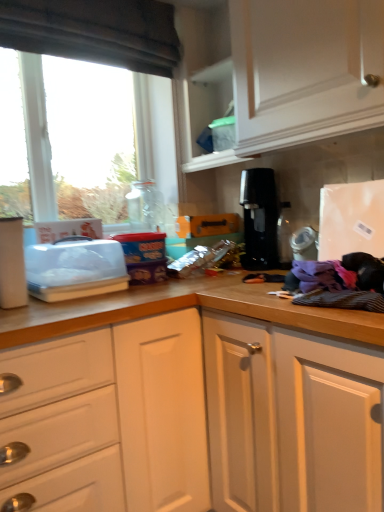
Question: Could you tell me if transparent glass window at left is facing dark fabric exhaust hood at upper left?

Choices:
 (A) no
 (B) yes

Answer: (A)

Question: Does transparent glass window at left have a lesser width compared to dark fabric exhaust hood at upper left?

Choices:
 (A) no
 (B) yes

Answer: (B)

Question: Are transparent glass window at left and dark fabric exhaust hood at upper left far apart?

Choices:
 (A) yes
 (B) no

Answer: (B)

Question: Is dark fabric exhaust hood at upper left a part of transparent glass window at left?

Choices:
 (A) no
 (B) yes

Answer: (A)

Question: Is dark fabric exhaust hood at upper left at the back of transparent glass window at left?

Choices:
 (A) no
 (B) yes

Answer: (A)

Question: Is transparent glass window at left positioned behind dark fabric exhaust hood at upper left?

Choices:
 (A) yes
 (B) no

Answer: (A)

Question: From the image's perspective, would you say transparent glass window at left is shown under black plastic coffee machine at center?

Choices:
 (A) no
 (B) yes

Answer: (A)

Question: Would you consider transparent glass window at left to be distant from black plastic coffee machine at center?

Choices:
 (A) yes
 (B) no

Answer: (B)

Question: Can you confirm if transparent glass window at left is taller than black plastic coffee machine at center?

Choices:
 (A) yes
 (B) no

Answer: (A)

Question: Is transparent glass window at left wider than black plastic coffee machine at center?

Choices:
 (A) no
 (B) yes

Answer: (A)

Question: Does transparent glass window at left have a lesser width compared to black plastic coffee machine at center?

Choices:
 (A) yes
 (B) no

Answer: (A)

Question: Does transparent glass window at left have a larger size compared to black plastic coffee machine at center?

Choices:
 (A) yes
 (B) no

Answer: (A)

Question: Can you confirm if clear plastic container at left is wider than dark fabric exhaust hood at upper left?

Choices:
 (A) no
 (B) yes

Answer: (B)